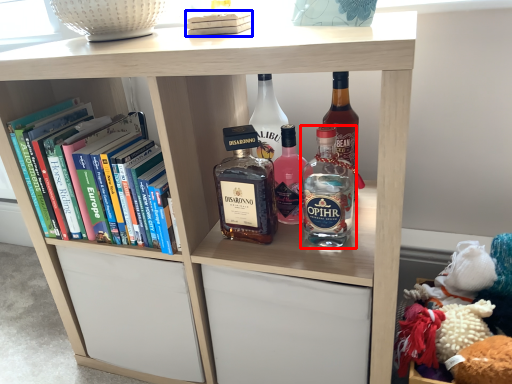
Question: Which of the following is the farthest to the observer, bottle (highlighted by a red box) or book (highlighted by a blue box)?

Choices:
 (A) bottle
 (B) book

Answer: (B)